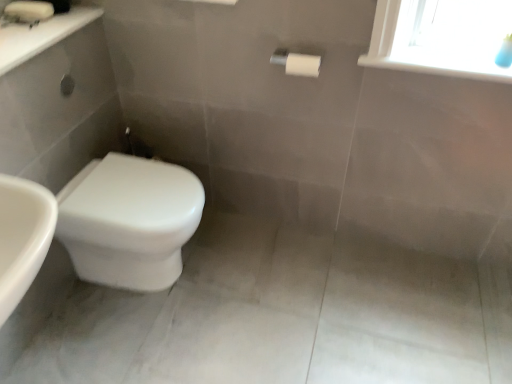
What do you see at coordinates (441, 66) in the screenshot?
I see `white plastic window sill at upper right` at bounding box center [441, 66].

The image size is (512, 384). In order to click on white glossy toilet at lower left in this screenshot , I will do `click(129, 221)`.

I want to click on white plastic window sill at upper right, so click(x=441, y=66).

From a real-world perspective, is white plastic window sill at upper right physically located above or below white glossy toilet at lower left?

From a real-world perspective, white plastic window sill at upper right is physically above white glossy toilet at lower left.

Is white plastic window sill at upper right located outside white glossy toilet at lower left?

white plastic window sill at upper right is positioned outside white glossy toilet at lower left.

Locate an element on the screen. This screenshot has width=512, height=384. window sill that appears above the white glossy toilet at lower left (from a real-world perspective) is located at coordinates (441, 66).

Is white plastic window sill at upper right with white glossy toilet at lower left?

There is a gap between white plastic window sill at upper right and white glossy toilet at lower left.

Considering the sizes of white glossy sink at upper left and white plastic window sill at upper right in the image, is white glossy sink at upper left wider or thinner than white plastic window sill at upper right?

In the image, white glossy sink at upper left appears to be wider than white plastic window sill at upper right.

Is white glossy sink at upper left inside or outside of white plastic window sill at upper right?

white glossy sink at upper left is located beyond the bounds of white plastic window sill at upper right.

In the scene shown: From the image's perspective, between white glossy sink at upper left and white plastic window sill at upper right, who is located below?

white plastic window sill at upper right appears lower in the image.

Find the location of a particular element. Image resolution: width=512 pixels, height=384 pixels. window sill in front of the white glossy toilet at lower left is located at coordinates 441,66.

Consider the image. Is white plastic window sill at upper right completely or partially inside white glossy toilet at lower left?

No, white glossy toilet at lower left does not contain white plastic window sill at upper right.

From a real-world perspective, is white glossy toilet at lower left physically located above or below white plastic window sill at upper right?

white glossy toilet at lower left is below white plastic window sill at upper right.

Measure the distance between white glossy toilet at lower left and white plastic window sill at upper right.

white glossy toilet at lower left and white plastic window sill at upper right are 38.64 inches apart from each other.

From a real-world perspective, is white glossy sink at upper left positioned above or below white glossy toilet at lower left?

white glossy sink at upper left is situated higher than white glossy toilet at lower left in the real world.

From the picture: From the image's perspective, between white glossy sink at upper left and white glossy toilet at lower left, which one is located above?

white glossy sink at upper left, from the image's perspective.

Is white glossy toilet at lower left at the back of white glossy sink at upper left?

white glossy sink at upper left does not have its back to white glossy toilet at lower left.

In terms of size, does white glossy sink at upper left appear bigger or smaller than white glossy toilet at lower left?

white glossy sink at upper left is smaller than white glossy toilet at lower left.

Consider the image. Could you tell me if white plastic window sill at upper right is turned towards white glossy sink at upper left?

No, white plastic window sill at upper right is not turned towards white glossy sink at upper left.

From a real-world perspective, who is located higher, white plastic window sill at upper right or white glossy sink at upper left?

white glossy sink at upper left, from a real-world perspective.

Based on their sizes in the image, would you say white plastic window sill at upper right is bigger or smaller than white glossy sink at upper left?

In the image, white plastic window sill at upper right appears to be smaller than white glossy sink at upper left.

From the picture: Would you say white plastic window sill at upper right is a long distance from white glossy sink at upper left?

white plastic window sill at upper right is positioned a significant distance from white glossy sink at upper left.

From the image's perspective, which object appears higher, white glossy toilet at lower left or white glossy sink at upper left?

white glossy sink at upper left appears higher in the image.

In terms of width, does white glossy toilet at lower left look wider or thinner when compared to white glossy sink at upper left?

white glossy toilet at lower left is wider than white glossy sink at upper left.

Which object is more forward, white glossy toilet at lower left or white glossy sink at upper left?

white glossy sink at upper left.

Locate an element on the screen. This screenshot has height=384, width=512. toilet below the white plastic window sill at upper right (from a real-world perspective) is located at coordinates (129, 221).

At what (x,y) coordinates should I click in order to perform the action: click on window sill behind the white glossy sink at upper left. Please return your answer as a coordinate pair (x, y). Image resolution: width=512 pixels, height=384 pixels. Looking at the image, I should click on (441, 66).

When comparing their distances from white glossy toilet at lower left, does white glossy sink at upper left or white plastic window sill at upper right seem closer?

Among the two, white glossy sink at upper left is located nearer to white glossy toilet at lower left.

From the image, which object appears to be nearer to white glossy sink at upper left, white plastic window sill at upper right or white glossy toilet at lower left?

The object closer to white glossy sink at upper left is white glossy toilet at lower left.

From the image, which object appears to be farther from white plastic window sill at upper right, white glossy sink at upper left or white glossy toilet at lower left?

white glossy sink at upper left is positioned further to the anchor white plastic window sill at upper right.

Which object lies nearer to the anchor point white glossy sink at upper left, white glossy toilet at lower left or white plastic window sill at upper right?

white glossy toilet at lower left lies closer to white glossy sink at upper left than the other object.

Based on their spatial positions, is white glossy toilet at lower left or white glossy sink at upper left closer to white plastic window sill at upper right?

white glossy toilet at lower left is positioned closer to the anchor white plastic window sill at upper right.

Based on their spatial positions, is white plastic window sill at upper right or white glossy sink at upper left closer to white glossy toilet at lower left?

The object closer to white glossy toilet at lower left is white glossy sink at upper left.

Find the location of a particular element. toilet situated between white glossy sink at upper left and white plastic window sill at upper right from left to right is located at coordinates (129, 221).